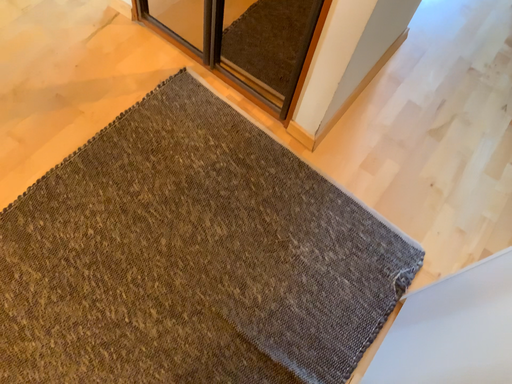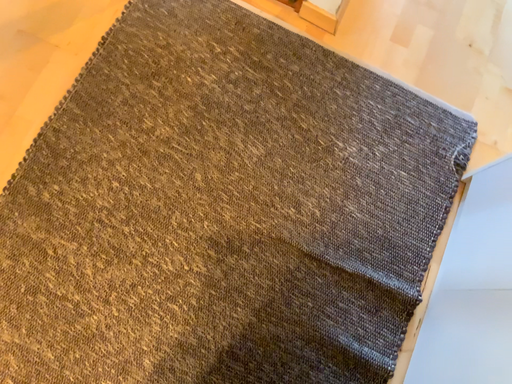
Question: Which way did the camera rotate in the video?

Choices:
 (A) rotated upward
 (B) rotated downward

Answer: (B)